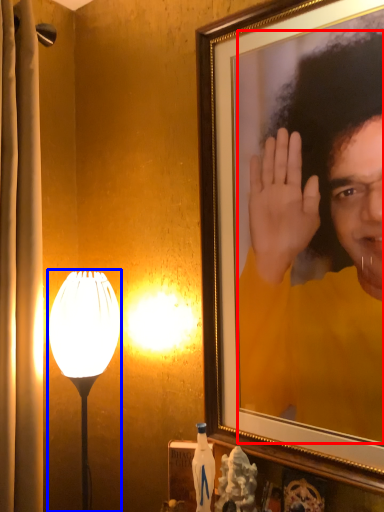
Question: Among these objects, which one is nearest to the camera, person (highlighted by a red box) or lamp (highlighted by a blue box)?

Choices:
 (A) person
 (B) lamp

Answer: (A)